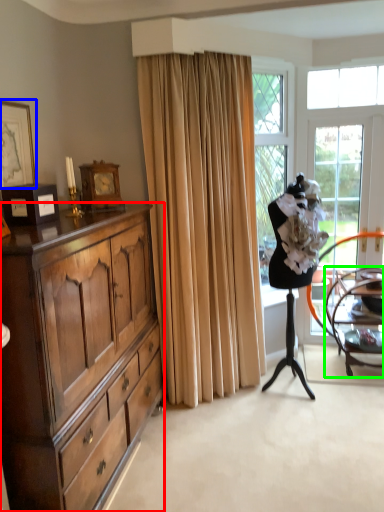
Question: Based on their relative distances, which object is farther from cabinetry (highlighted by a red box)? Choose from picture frame (highlighted by a blue box) and chair (highlighted by a green box).

Choices:
 (A) picture frame
 (B) chair

Answer: (B)